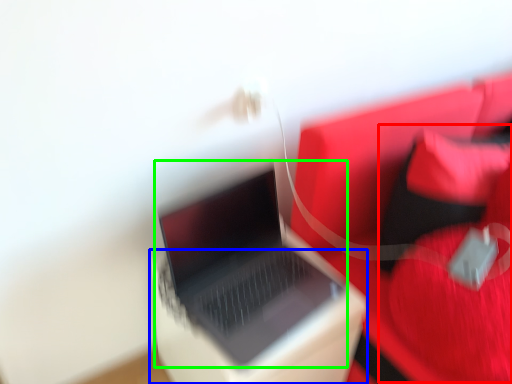
Question: Which is nearer to the bean bag chair (highlighted by a red box)? cardboard box (highlighted by a blue box) or laptop (highlighted by a green box).

Choices:
 (A) cardboard box
 (B) laptop

Answer: (A)